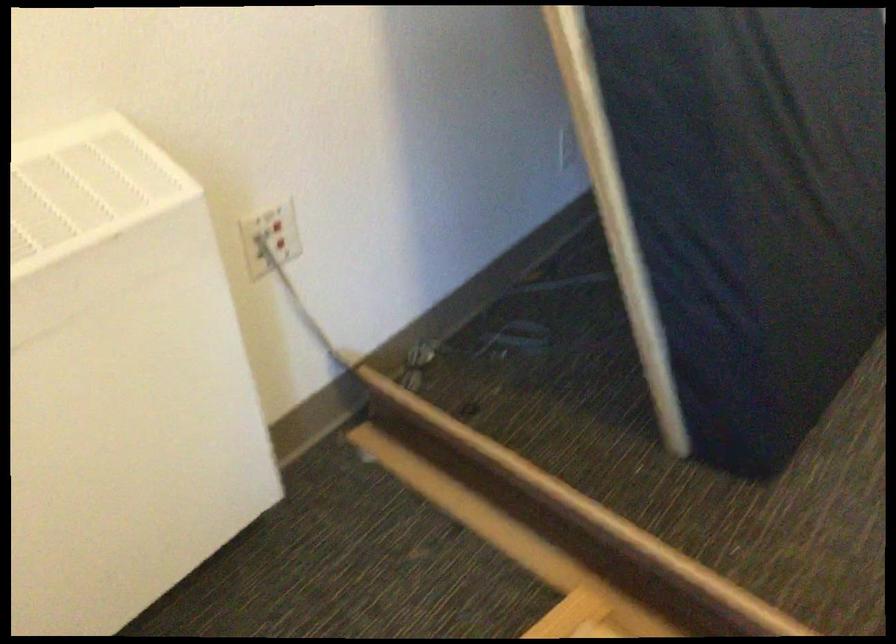
What do you see at coordinates (273, 232) in the screenshot? I see `a red outlet button` at bounding box center [273, 232].